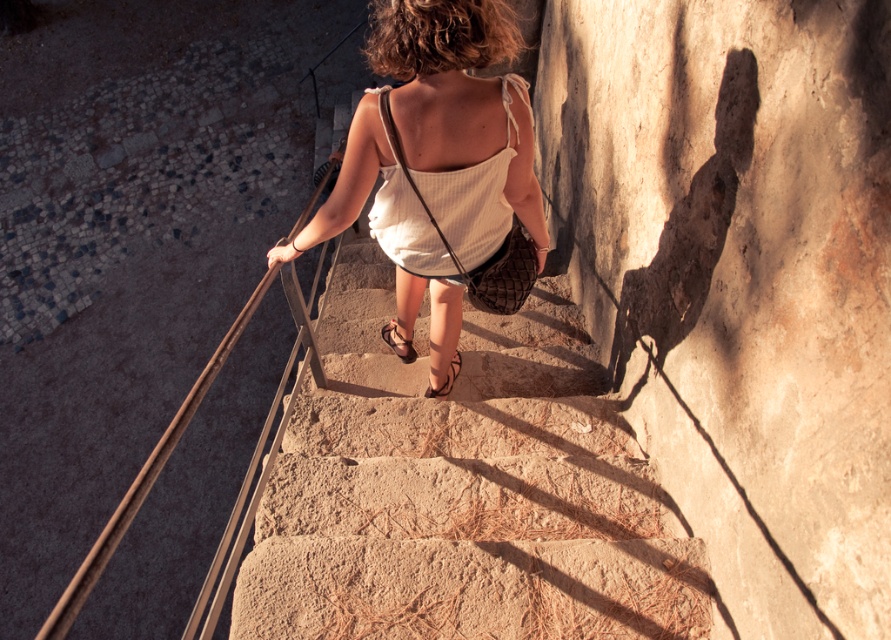
Question: Which object appears farthest from the camera in this image?

Choices:
 (A) matte white tank top at center
 (B) stone textured stairs at center

Answer: (B)

Question: Among these points, which one is farthest from the camera?

Choices:
 (A) (391, 291)
 (B) (398, 13)

Answer: (A)

Question: Can you confirm if stone textured stairs at center is thinner than brown leather sandal at center?

Choices:
 (A) no
 (B) yes

Answer: (A)

Question: Can you confirm if matte white tank top at center is positioned below white ribbed fabric dress at center?

Choices:
 (A) yes
 (B) no

Answer: (B)

Question: Estimate the real-world distances between objects in this image. Which object is farther from the matte brown sandal at center?

Choices:
 (A) matte white tank top at center
 (B) white ribbed fabric dress at center
 (C) brown leather sandal at center
 (D) stone textured stairs at center

Answer: (B)

Question: Can you confirm if white ribbed fabric dress at center is positioned to the left of matte brown sandal at center?

Choices:
 (A) yes
 (B) no

Answer: (B)